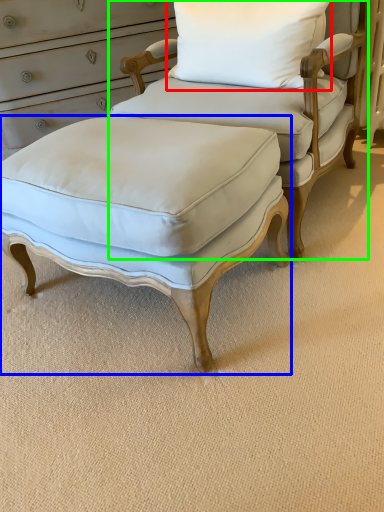
Question: Which object is the closest to the pillow (highlighted by a red box)? Choose among these: stool (highlighted by a blue box) or chair (highlighted by a green box).

Choices:
 (A) stool
 (B) chair

Answer: (B)